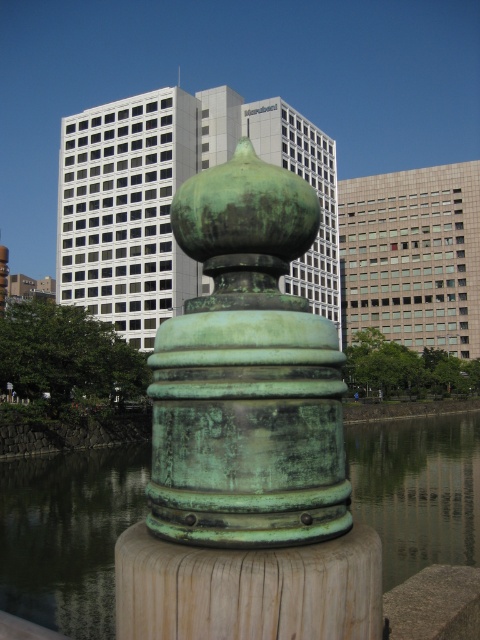
You are a city planner assessing the space around the green patina cylinder at center and the green patina water at center. Based on their widths, which one occupies more horizontal space in the image?

The green patina water at center occupies more horizontal space because its width is greater than the green patina cylinder at center.

You are standing at the center of the image and want to place a new decorative plaque on the green patina cylinder at center. Since the cylinder is at a specific coordinate, can you confirm its exact 2D location in the image?

The green patina cylinder at center is located at the 2D coordinate point of [247,372].